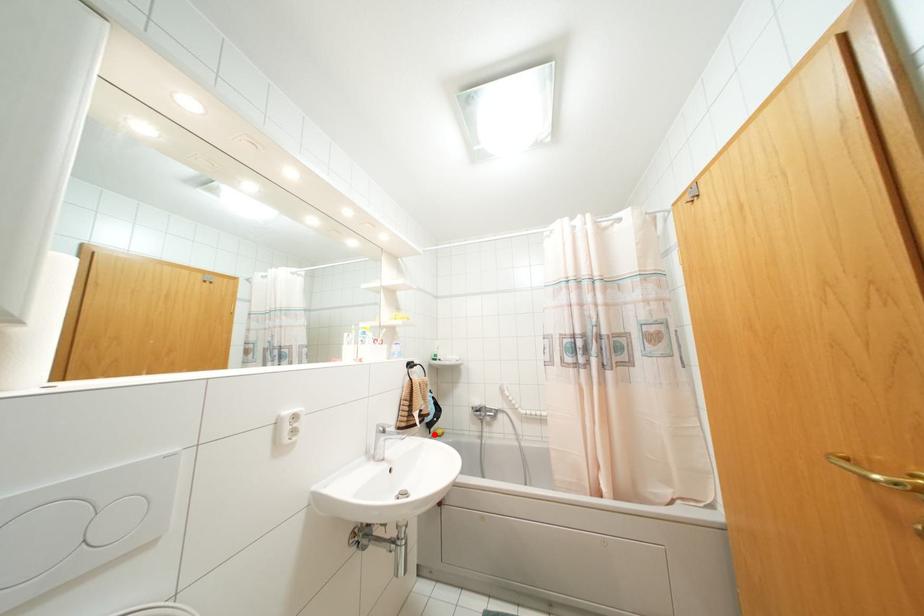
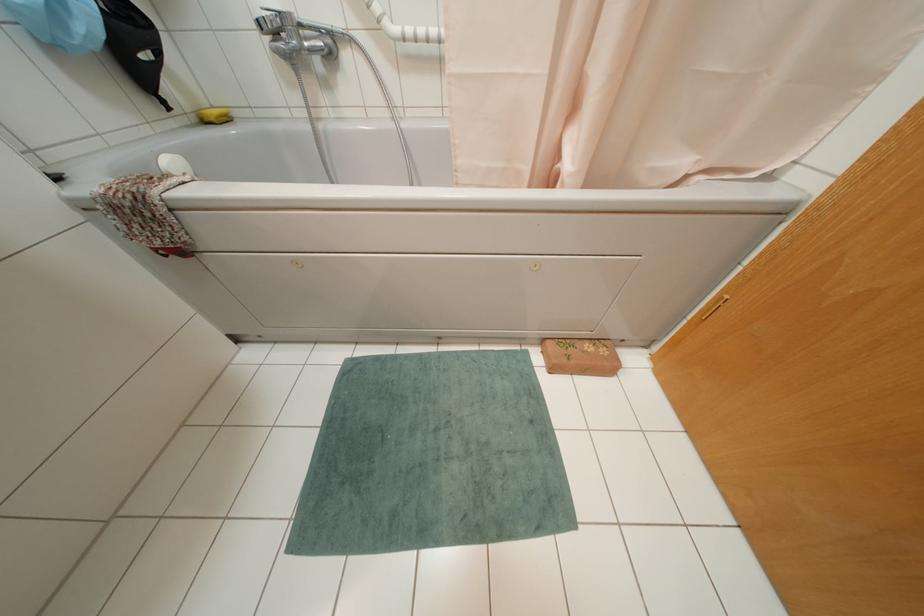
The point at the highlighted location is marked in the first image. Where is the corresponding point in the second image?

(202, 121)